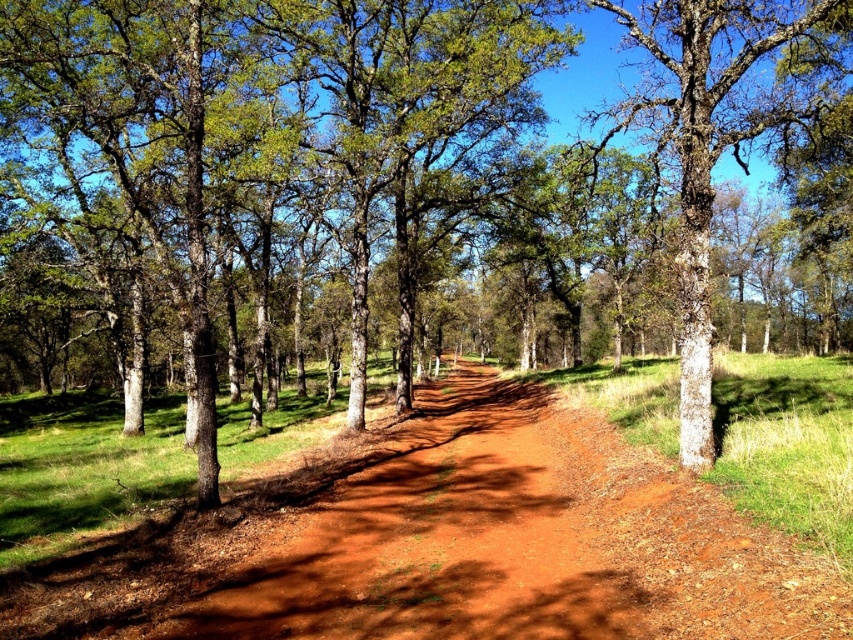
Which is behind, point (378, 589) or point (650, 52)?

Positioned behind is point (650, 52).

This screenshot has width=853, height=640. What are the coordinates of `dusty red dirt track at center` in the screenshot? It's located at (451, 545).